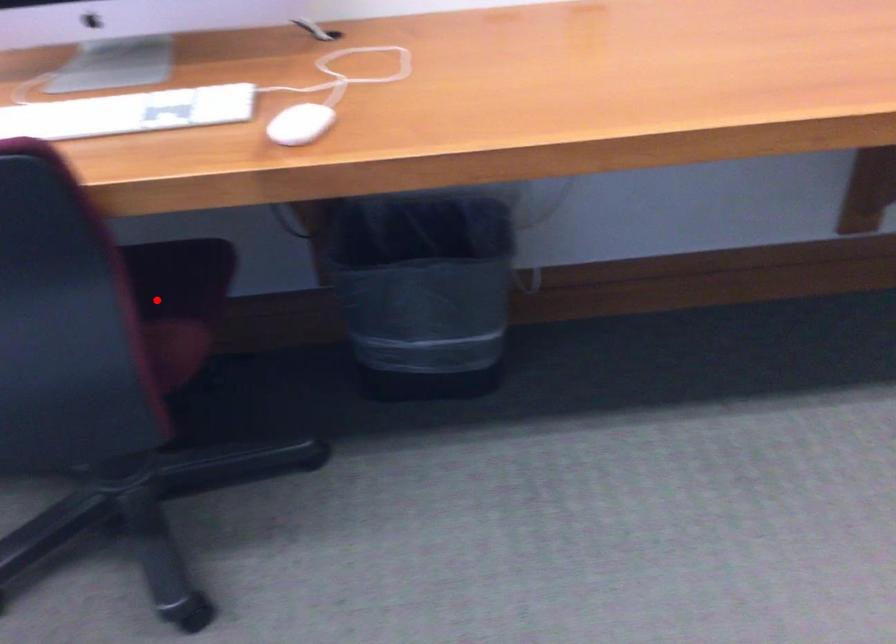
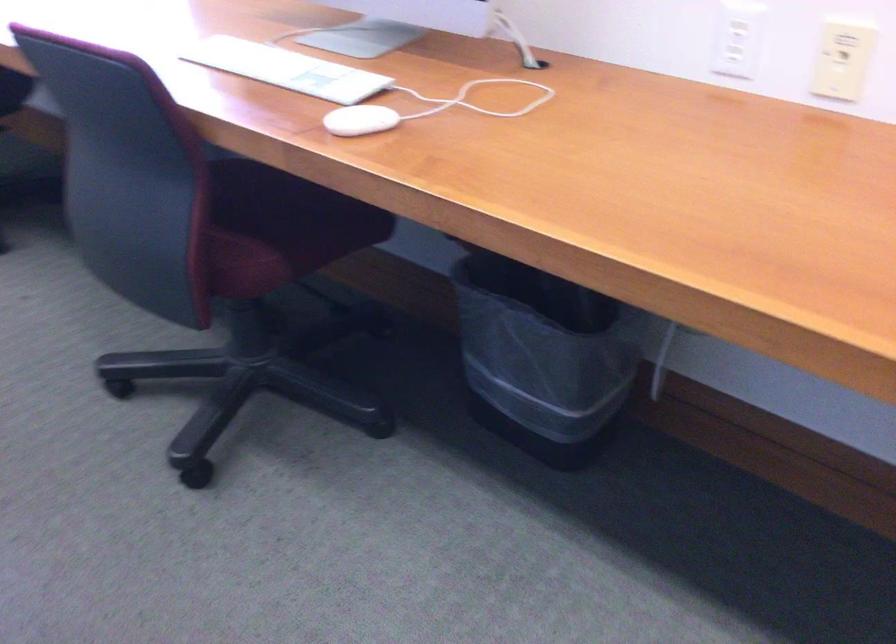
Question: A red point is marked in image1. In image2, is the corresponding 3D point closer to the camera or farther? Reply with the corresponding letter.

Choices:
 (A) The corresponding 3D point is closer.
 (B) The corresponding 3D point is farther.

Answer: (B)